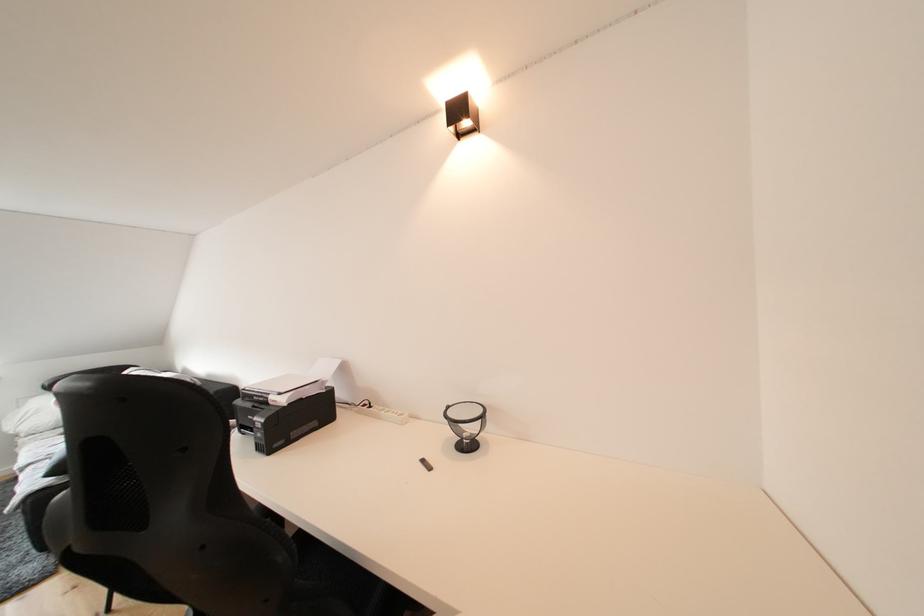
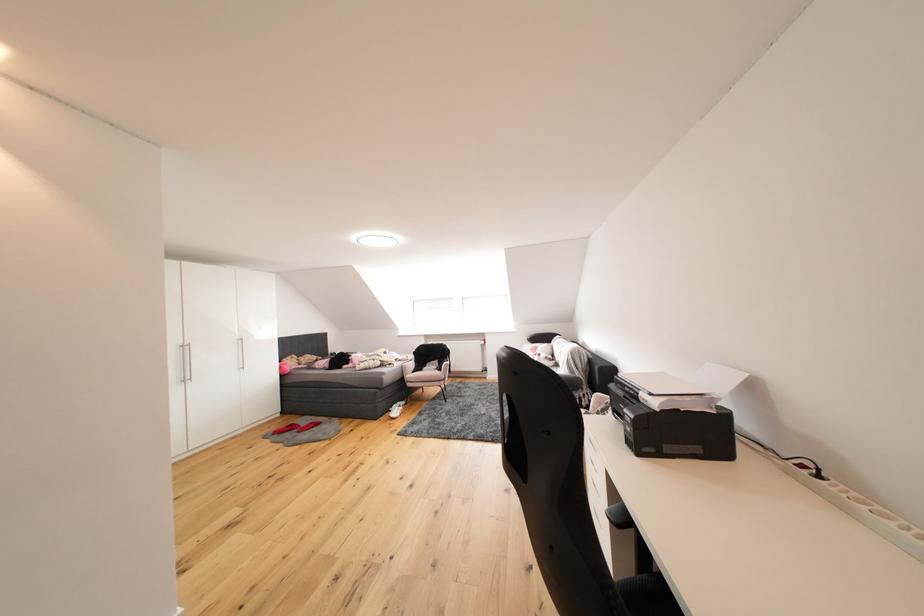
Question: The camera is either moving clockwise (left) or counter-clockwise (right) around the object. The first image is from the beginning of the video and the second image is from the end. Is the camera moving left or right when shooting the video?

Choices:
 (A) Left
 (B) Right

Answer: (B)